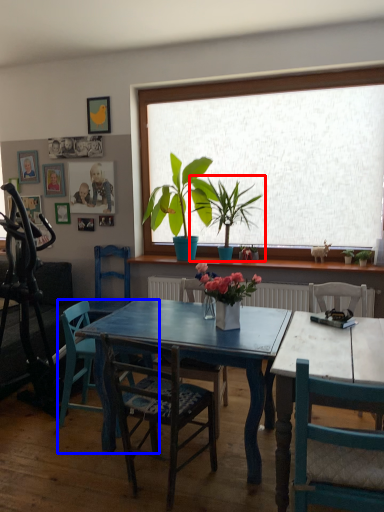
Question: Among these objects, which one is nearest to the camera, houseplant (highlighted by a red box) or chair (highlighted by a blue box)?

Choices:
 (A) houseplant
 (B) chair

Answer: (B)